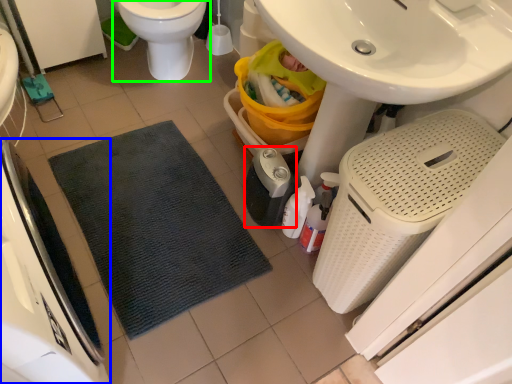
Question: Based on their relative distances, which object is farther from appliance (highlighted by a red box)? Choose from appliance (highlighted by a blue box) and toilet (highlighted by a green box).

Choices:
 (A) appliance
 (B) toilet

Answer: (A)